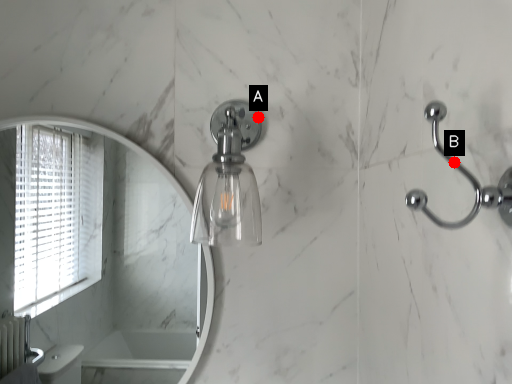
Question: Two points are circled on the image, labeled by A and B beside each circle. Which of the following is the farthest from the observer?

Choices:
 (A) A is further
 (B) B is further

Answer: (A)